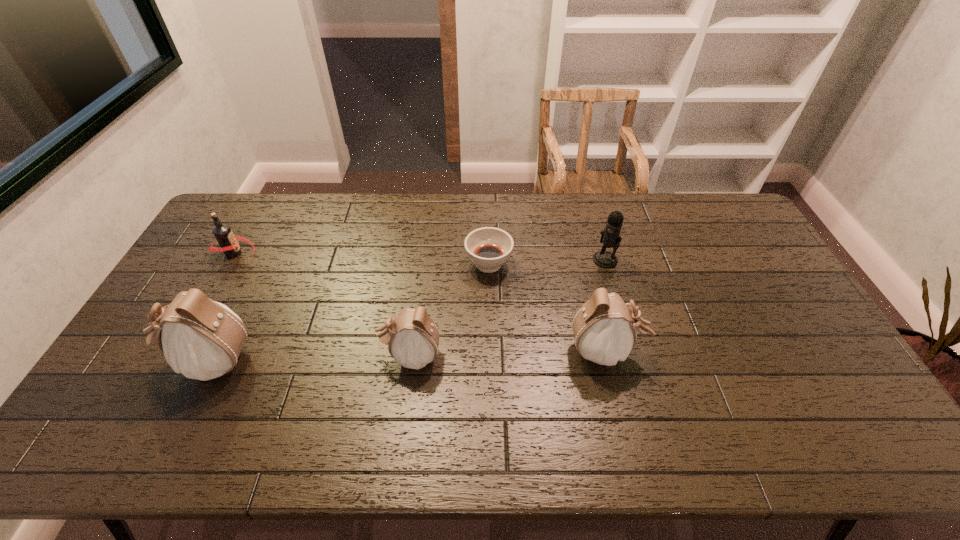
The pouchs are evenly distributed in the image. To maintain this, where would you place another pouch on the right? Please point to a free space. Please provide its 2D coordinates. Your answer should be formatted as a tuple, i.e. [(x, y)], where the tuple contains the x and y coordinates of a point satisfying the conditions above.

[(799, 347)]